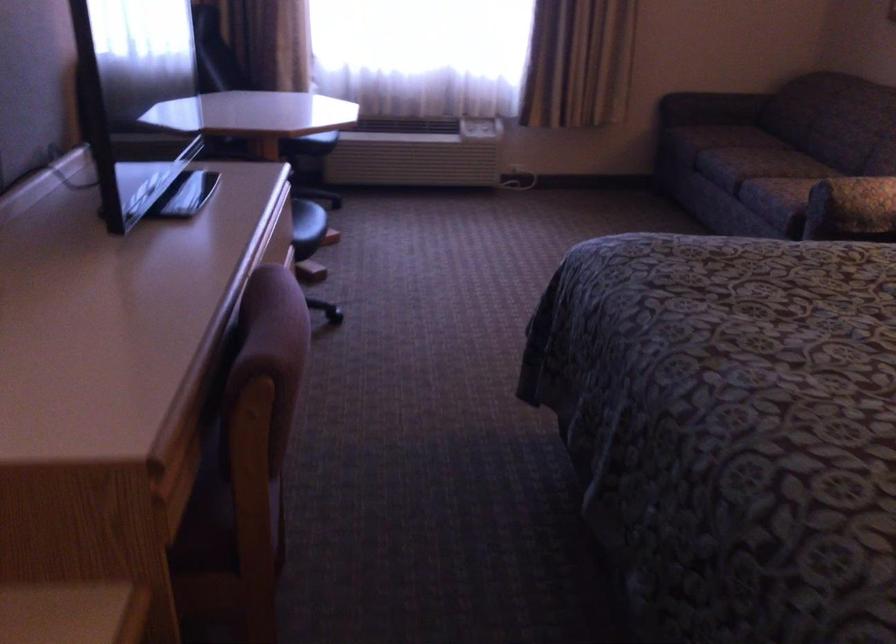
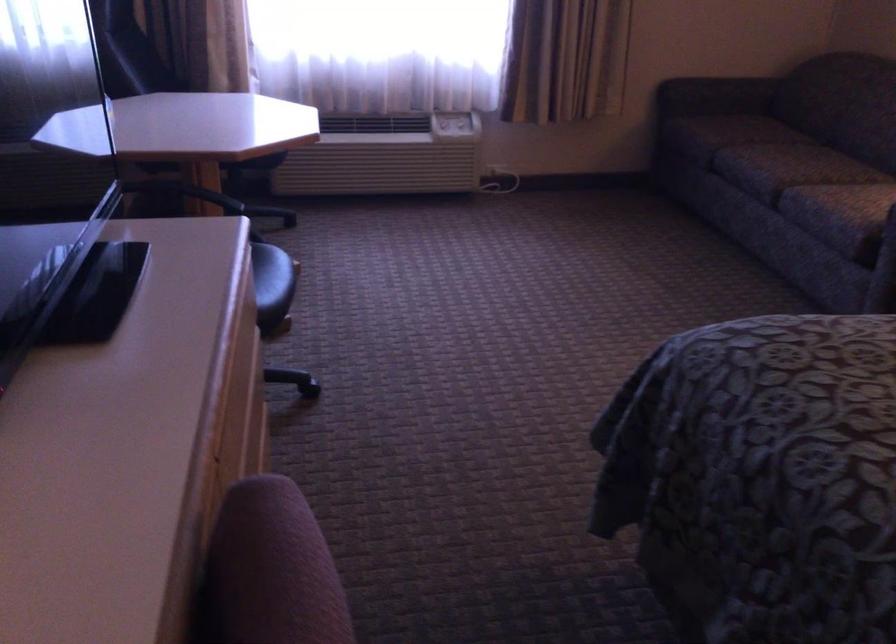
Question: Which direction would the cameraman need to move to produce the second image? Reply with the corresponding letter.

Choices:
 (A) Left
 (B) Right
 (C) Forward
 (D) Backward

Answer: (C)